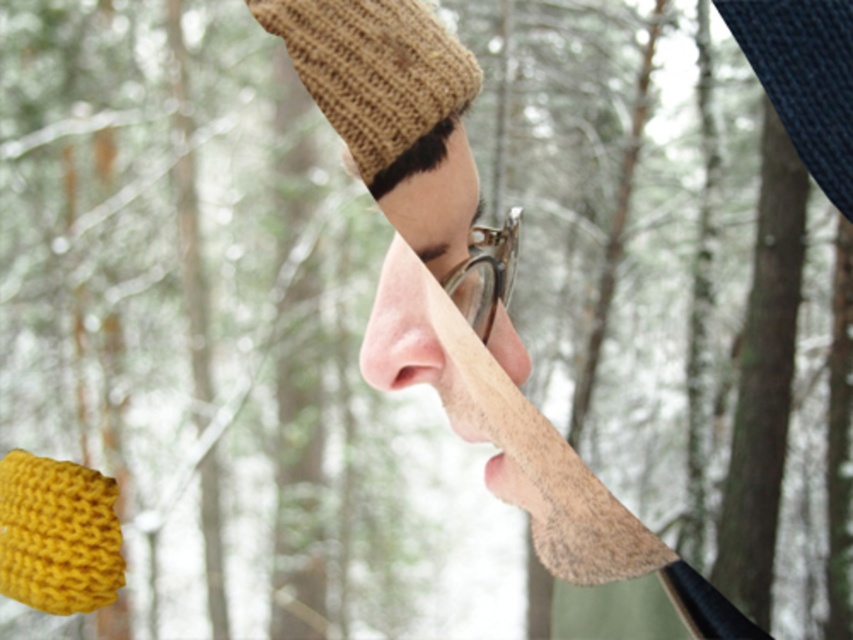
You are a photographer trying to capture the person in the image. You need to adjust your focus so that both the smooth skin nose at center and the knitted yellow scarf at lower left are clearly visible. Which object should you focus on first to ensure both are in focus?

You should focus on the smooth skin nose at center first because it is closer to the camera than the knitted yellow scarf at lower left. By focusing on the closer object, the background object will also be in focus due to the depth of field.

Based on the scene, can you determine which object is wider between the knitted brown hat at upper center and the smooth skin nose at center?

The knitted brown hat at upper center is wider than the smooth skin nose at center according to the description.

You are a photographer trying to capture a portrait of the person in the image. You need to adjust your camera to focus on both the knitted brown hat at upper center and the knitted yellow scarf at lower left. Which object should you focus on first to ensure both are in sharp focus?

You should focus on the knitted brown hat at upper center first because it is positioned on the right side of the knitted yellow scarf at lower left, so adjusting focus starting from the right will help capture both objects clearly.